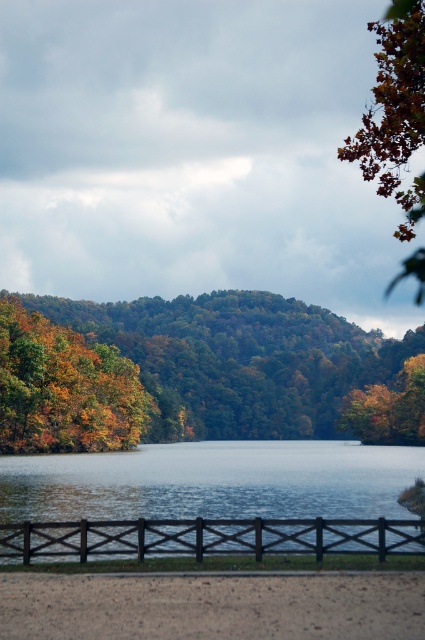
You are standing on the sandy path in front of the black wood fence at lower center. You want to see the clear water at center beyond the fence. Based on their heights, can you see the water over the fence?

The clear water at center is taller than the black wood fence at lower center, so yes, you can see the clear water at center over the fence since it is higher than the fence.

You are standing on the path in front of the black wood fence at lower center and looking towards the autumn leaves at center. Which object is taller?

The autumn leaves at center are taller than the black wood fence at lower center.